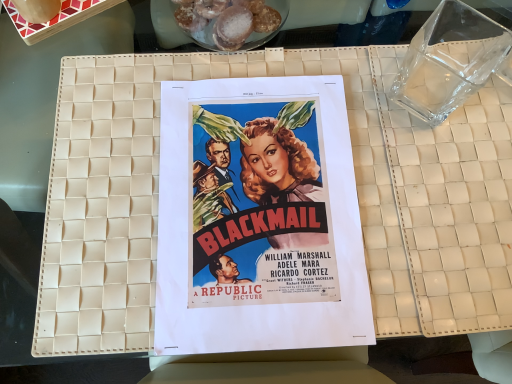
Where is `blank space situated above matte paper poster at center (from a real-world perspective)`? blank space situated above matte paper poster at center (from a real-world perspective) is located at coordinates (251, 193).